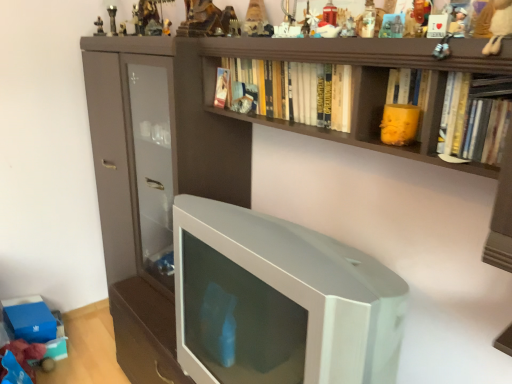
Question: In which direction should I rotate to look at metallic figurine at upper center, arranged as the twelfth toy when viewed from the right?

Choices:
 (A) right
 (B) left

Answer: (B)

Question: Is matte plastic toy at upper center, the 9th toy viewed from the right, turned away from hardcover book at upper center, acting as the 2th book starting from the left?

Choices:
 (A) yes
 (B) no

Answer: (B)

Question: Would you consider matte plastic toy at upper center, positioned as the 4th toy in back-to-front order, to be distant from hardcover book at upper center, the 2th book positioned from the front?

Choices:
 (A) no
 (B) yes

Answer: (A)

Question: From a real-world perspective, is matte plastic toy at upper center, the 9th toy viewed from the right, positioned under hardcover book at upper center, the second book from the back, based on gravity?

Choices:
 (A) no
 (B) yes

Answer: (A)

Question: Is matte plastic toy at upper center, which appears as the 5th toy when viewed from the left, with hardcover book at upper center, the second book from the back?

Choices:
 (A) yes
 (B) no

Answer: (B)

Question: From the image's perspective, is matte plastic toy at upper center, which appears as the 5th toy when viewed from the left, under hardcover book at upper center, the second book from the back?

Choices:
 (A) no
 (B) yes

Answer: (A)

Question: Would you say hardcover book at upper center, the second book from the back, is part of matte plastic toy at upper center, marked as the 10th toy in a front-to-back arrangement,'s contents?

Choices:
 (A) yes
 (B) no

Answer: (B)

Question: Is metallic silver toy at upper center, placed as the 12th toy when sorted from back to front, shorter than hardcover book at upper center, the 2th book positioned from the front?

Choices:
 (A) no
 (B) yes

Answer: (B)

Question: Does metallic silver toy at upper center, placed as the 12th toy when sorted from back to front, have a smaller size compared to hardcover book at upper center, acting as the 2th book starting from the left?

Choices:
 (A) no
 (B) yes

Answer: (B)

Question: Is metallic silver toy at upper center, which is the 4th toy from right to left, at the left side of hardcover book at upper center, the second book from the back?

Choices:
 (A) no
 (B) yes

Answer: (A)

Question: Considering the relative positions of metallic silver toy at upper center, arranged as the 2th toy when viewed from the front, and hardcover book at upper center, the second book from the back, in the image provided, is metallic silver toy at upper center, arranged as the 2th toy when viewed from the front, in front of hardcover book at upper center, the second book from the back,?

Choices:
 (A) no
 (B) yes

Answer: (B)

Question: From the image's perspective, is metallic silver toy at upper center, which is the 4th toy from right to left, over hardcover book at upper center, the second book from the back?

Choices:
 (A) yes
 (B) no

Answer: (A)

Question: Is hardcover book at upper center, which is the 2th book in right-to-left order, inside metallic silver toy at upper center, arranged as the 2th toy when viewed from the front?

Choices:
 (A) no
 (B) yes

Answer: (A)

Question: Considering the relative sizes of metallic silver figurine at upper center, the eighth toy when ordered from left to right, and white plush toy at upper right, which is the 13th toy from left to right, in the image provided, is metallic silver figurine at upper center, the eighth toy when ordered from left to right, thinner than white plush toy at upper right, which is the 13th toy from left to right,?

Choices:
 (A) yes
 (B) no

Answer: (A)